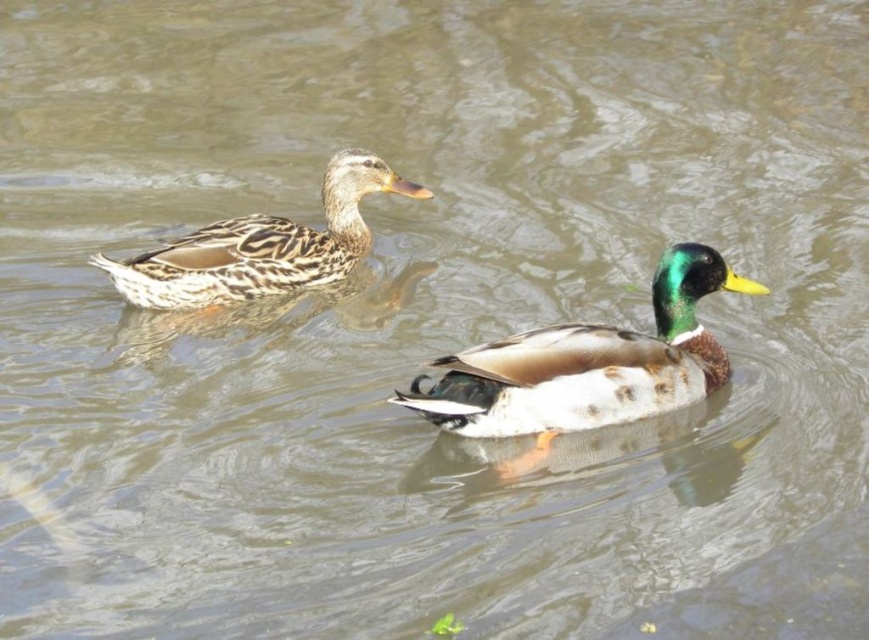
Between green glossy duck at center and speckled feathered duck at left, which one appears on the left side from the viewer's perspective?

speckled feathered duck at left is more to the left.

Who is positioned more to the right, green glossy duck at center or speckled feathered duck at left?

From the viewer's perspective, green glossy duck at center appears more on the right side.

Which is in front, point (561, 410) or point (355, 236)?

Positioned in front is point (561, 410).

Identify the location of green glossy duck at center. (587, 365).